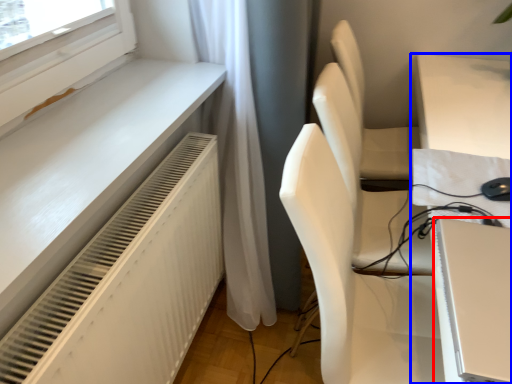
Question: Which object is further to the camera taking this photo, computer (highlighted by a red box) or table (highlighted by a blue box)?

Choices:
 (A) computer
 (B) table

Answer: (A)